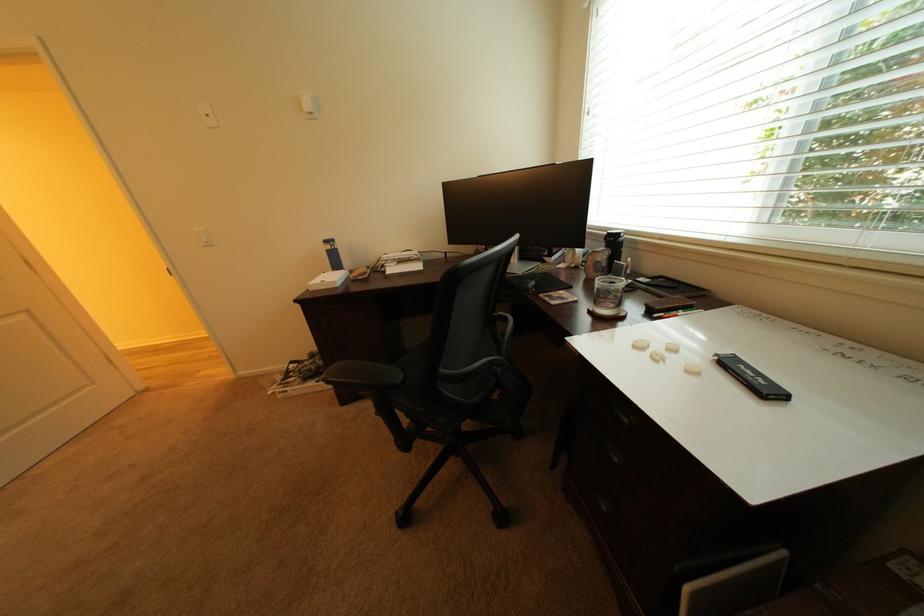
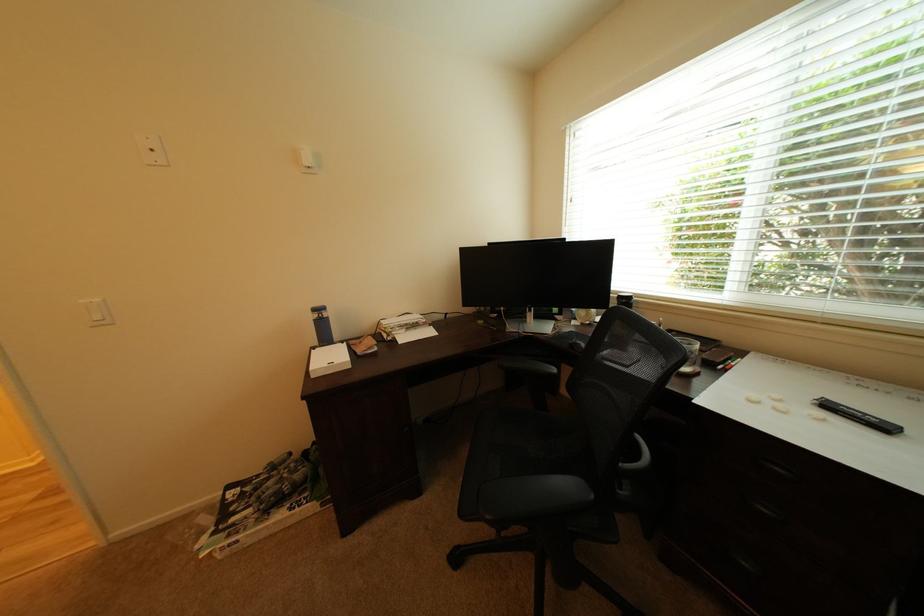
In the second image, find the point that corresponds to (x=738, y=365) in the first image.

(840, 408)